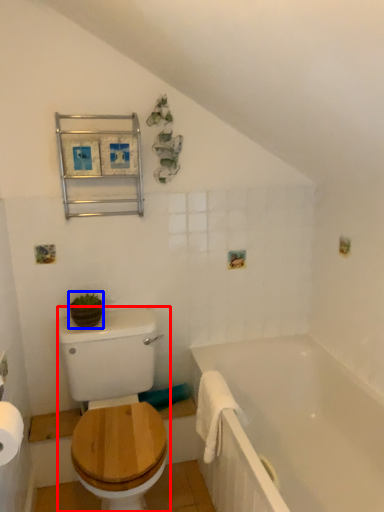
Question: Which object appears closest to the camera in this image, sit (highlighted by a red box) or plant (highlighted by a blue box)?

Choices:
 (A) sit
 (B) plant

Answer: (A)